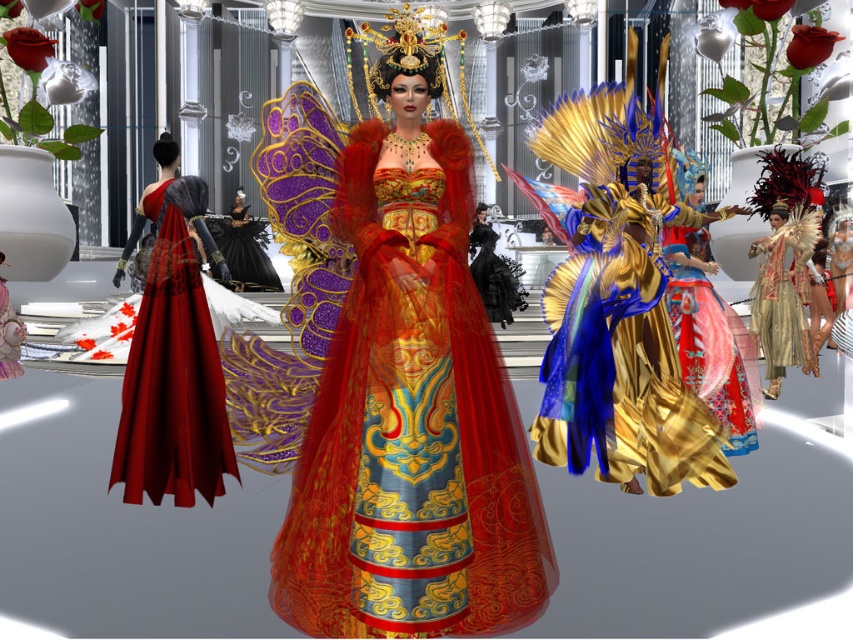
At what (x,y) coordinates should I click in order to perform the action: click on shiny silk gown at center. Please return your answer as a coordinate pair (x, y). The image size is (853, 640). Looking at the image, I should click on (410, 403).

Does shiny silk gown at center have a smaller size compared to matte black gown at left?

No, shiny silk gown at center is not smaller than matte black gown at left.

Which is in front, point (375, 266) or point (154, 410)?

Point (375, 266) is more forward.

Identify the location of shiny silk gown at center. Image resolution: width=853 pixels, height=640 pixels. (410, 403).

Is shiny silk gown at center bigger than shiny gold fabric dress at center?

Correct, shiny silk gown at center is larger in size than shiny gold fabric dress at center.

Can you confirm if shiny silk gown at center is shorter than shiny gold fabric dress at center?

Incorrect, shiny silk gown at center's height does not fall short of shiny gold fabric dress at center's.

Locate an element on the screen. shiny silk gown at center is located at coordinates (410, 403).

Image resolution: width=853 pixels, height=640 pixels. I want to click on shiny silk gown at center, so click(x=410, y=403).

Between matte black gown at left and black satin gown at center, which one appears on the right side from the viewer's perspective?

From the viewer's perspective, matte black gown at left appears more on the right side.

Describe the element at coordinates (173, 358) in the screenshot. The height and width of the screenshot is (640, 853). I see `matte black gown at left` at that location.

Between point (169, 305) and point (242, 241), which one is positioned behind?

The point (242, 241) is behind.

The width and height of the screenshot is (853, 640). What are the coordinates of `matte black gown at left` in the screenshot? It's located at (173, 358).